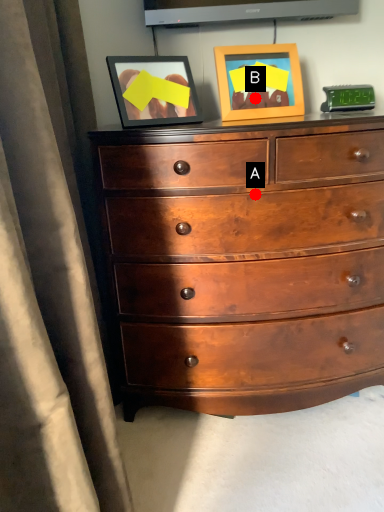
Question: Two points are circled on the image, labeled by A and B beside each circle. Which of the following is the closest to the observer?

Choices:
 (A) A is closer
 (B) B is closer

Answer: (A)